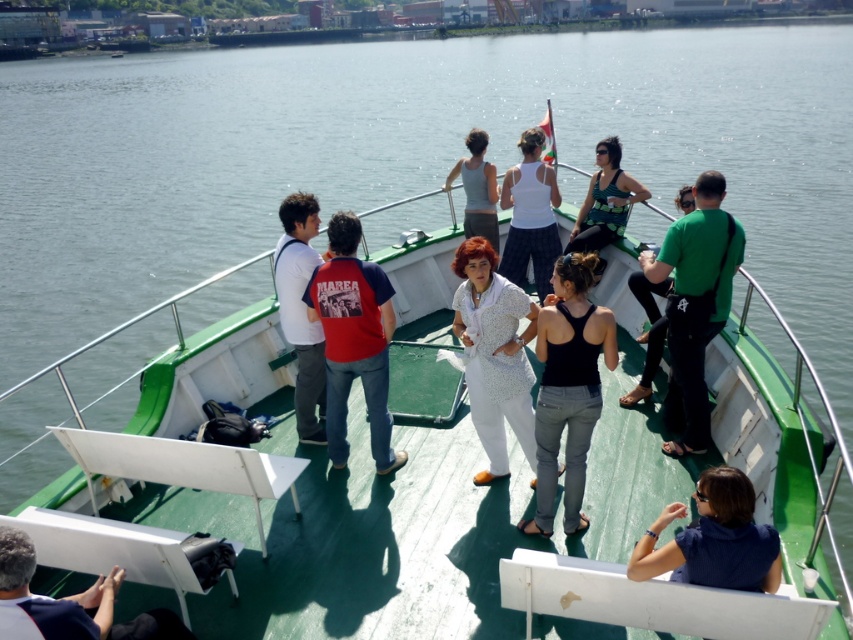
Question: Which of the following is the farthest from the observer?

Choices:
 (A) dark blue fabric shoe at lower left
 (B) blue fabric shirt at lower right
 (C) white fabric tank top at center

Answer: (C)

Question: Does white matte shirt at center have a greater width compared to green textured tank top at center?

Choices:
 (A) no
 (B) yes

Answer: (A)

Question: Which point is closer to the camera?

Choices:
 (A) (514, 180)
 (B) (764, 582)
 (C) (386, 458)
 (D) (585, 237)

Answer: (B)

Question: Can you confirm if white textured blouse at center is thinner than blue fabric shirt at lower right?

Choices:
 (A) no
 (B) yes

Answer: (A)

Question: Which point is farther to the camera?

Choices:
 (A) (491, 272)
 (B) (486, 168)
 (C) (556, 195)

Answer: (B)

Question: Is white textured blouse at center behind dark blue fabric shoe at lower left?

Choices:
 (A) yes
 (B) no

Answer: (A)